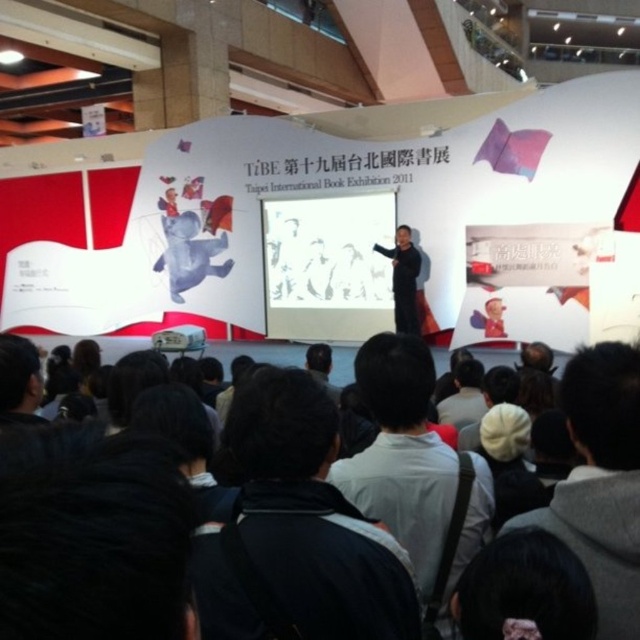
This screenshot has height=640, width=640. Describe the element at coordinates (296, 531) in the screenshot. I see `dark gray jacket at center` at that location.

Which is in front, point (266, 563) or point (598, 364)?

Point (266, 563) is more forward.

The width and height of the screenshot is (640, 640). I want to click on dark gray jacket at center, so click(x=296, y=531).

Looking at this image, does white fabric at center have a lesser height compared to white cotton hoodie at lower right?

No, white fabric at center is not shorter than white cotton hoodie at lower right.

Does white fabric at center have a lesser width compared to white cotton hoodie at lower right?

In fact, white fabric at center might be wider than white cotton hoodie at lower right.

The image size is (640, 640). I want to click on white fabric at center, so click(x=416, y=470).

Find the location of a particular element. This screenshot has width=640, height=640. white fabric at center is located at coordinates (416, 470).

Does dark gray jacket at center appear over black matte suit at center?

Incorrect, dark gray jacket at center is not positioned above black matte suit at center.

Find the location of a particular element. dark gray jacket at center is located at coordinates (296, 531).